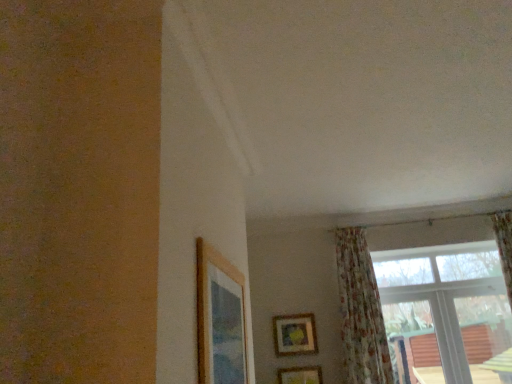
Question: Considering the relative sizes of wooden picture frame at upper center, the 2th picture frame when ordered from front to back, and floral fabric curtain at lower right in the image provided, is wooden picture frame at upper center, the 2th picture frame when ordered from front to back, taller than floral fabric curtain at lower right?

Choices:
 (A) no
 (B) yes

Answer: (A)

Question: Is wooden picture frame at upper center, the 2th picture frame when ordered from front to back, facing away from floral fabric curtain at lower right?

Choices:
 (A) no
 (B) yes

Answer: (A)

Question: Is wooden picture frame at upper center, the 2th picture frame when ordered from front to back, further to camera compared to floral fabric curtain at lower right?

Choices:
 (A) yes
 (B) no

Answer: (A)

Question: Is the depth of wooden picture frame at upper center, positioned as the 1th picture frame in right-to-left order, less than that of floral fabric curtain at lower right?

Choices:
 (A) yes
 (B) no

Answer: (B)

Question: Considering the relative sizes of wooden picture frame at upper center, positioned as the 1th picture frame in right-to-left order, and floral fabric curtain at lower right in the image provided, is wooden picture frame at upper center, positioned as the 1th picture frame in right-to-left order, thinner than floral fabric curtain at lower right?

Choices:
 (A) yes
 (B) no

Answer: (A)

Question: Does point (310, 380) appear closer or farther from the camera than point (224, 337)?

Choices:
 (A) farther
 (B) closer

Answer: (A)

Question: In terms of height, does wooden picture frame at upper center, marked as the 3th picture frame in a top-to-bottom arrangement, look taller or shorter compared to wooden picture frame at upper left, which ranks as the first picture frame in front-to-back order?

Choices:
 (A) short
 (B) tall

Answer: (A)

Question: From a real-world perspective, is wooden picture frame at upper center, marked as the 3th picture frame in a top-to-bottom arrangement, positioned above or below wooden picture frame at upper left, which appears as the first picture frame when viewed from the top?

Choices:
 (A) above
 (B) below

Answer: (B)

Question: From the image's perspective, relative to wooden picture frame at upper left, marked as the third picture frame in a right-to-left arrangement, is wooden picture frame at upper center, positioned as the 2th picture frame in back-to-front order, above or below?

Choices:
 (A) above
 (B) below

Answer: (B)

Question: Is floral fabric curtain at lower right wider or thinner than wooden picture frame at upper left, marked as the third picture frame in a right-to-left arrangement?

Choices:
 (A) thin
 (B) wide

Answer: (B)

Question: From the image's perspective, is floral fabric curtain at lower right located above or below wooden picture frame at upper left, arranged as the third picture frame when ordered from the bottom?

Choices:
 (A) below
 (B) above

Answer: (A)

Question: Is floral fabric curtain at lower right taller or shorter than wooden picture frame at upper left, marked as the third picture frame in a right-to-left arrangement?

Choices:
 (A) short
 (B) tall

Answer: (B)

Question: Based on their positions, is floral fabric curtain at lower right located to the left or right of wooden picture frame at upper left, which ranks as the first picture frame in front-to-back order?

Choices:
 (A) right
 (B) left

Answer: (A)

Question: From a real-world perspective, is transparent glass window at upper right positioned above or below wooden picture frame at upper left, which appears as the first picture frame when viewed from the top?

Choices:
 (A) above
 (B) below

Answer: (A)

Question: Visually, is transparent glass window at upper right positioned to the left or to the right of wooden picture frame at upper left, which appears as the first picture frame when viewed from the top?

Choices:
 (A) left
 (B) right

Answer: (B)